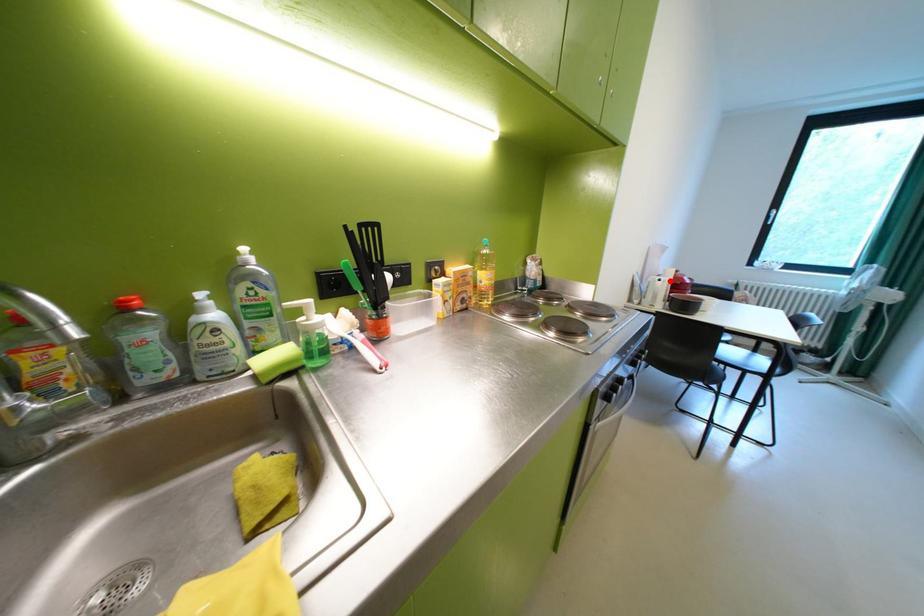
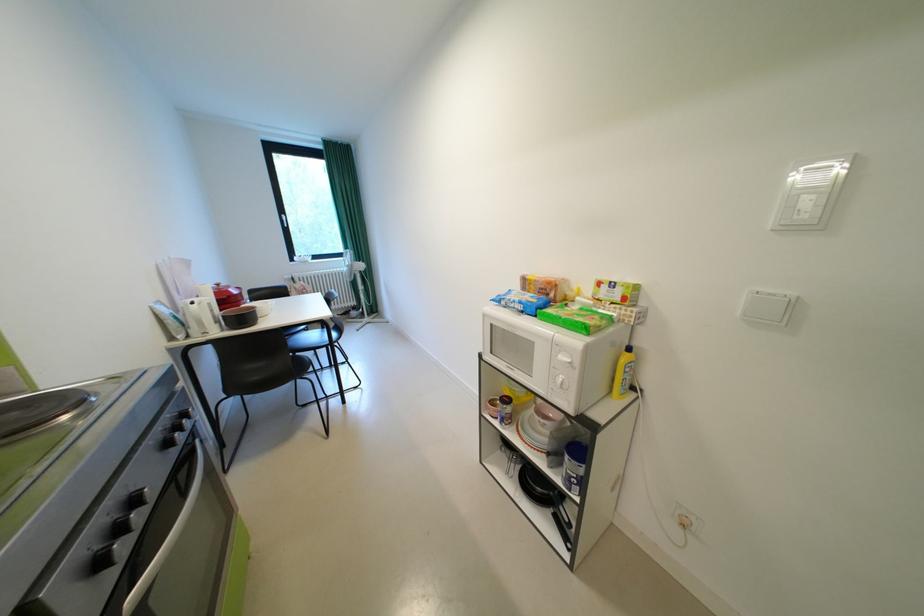
Where in the second image is the point corresponding to the highlighted location from the first image?

(203, 304)